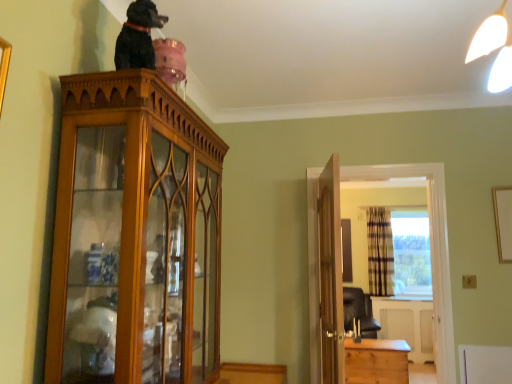
Question: From their relative heights in the image, would you say transparent glass window at center is taller or shorter than wooden door at center?

Choices:
 (A) short
 (B) tall

Answer: (A)

Question: From the image's perspective, is transparent glass window at center located above or below wooden door at center?

Choices:
 (A) below
 (B) above

Answer: (A)

Question: Which is farther from the plaid fabric curtain at right?

Choices:
 (A) black glossy statue at upper center
 (B) wooden cabinet at right
 (C) transparent glass window at center
 (D) wooden cabinet at upper left
 (E) light brown wooden chest at lower right

Answer: (A)

Question: Which object is positioned closest to the light brown wooden chest at lower right?

Choices:
 (A) wooden door at center
 (B) plaid fabric curtain at right
 (C) wooden cabinet at right
 (D) transparent glass window at center
 (E) black glossy statue at upper center

Answer: (C)